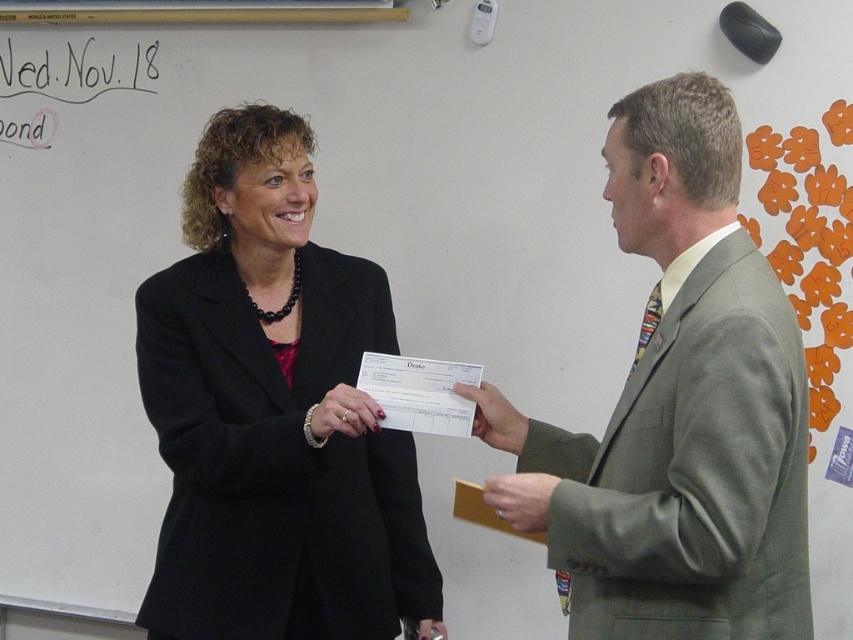
You are an observer in the classroom. You notice the black matte blazer at center and the matte gray suit at right. Which clothing item takes up more space in the image?

The black matte blazer at center takes up more space in the image because it is bigger than the matte gray suit at right.

Based on the photo, you are organizing a meeting and need to place a name tag on the table. The name tag is the size of the matte black check at center. Can you fit it on the white paper at center without overlapping the edges?

The white paper at center is bigger than the matte black check at center, so yes, the name tag can fit on the white paper at center without overlapping the edges.

You are standing in the classroom and want to hand a document to the person wearing the black matte blazer at center. Based on the coordinates provided, in which direction should you move to reach them?

The black matte blazer at center is located at coordinates point (271, 413). Since the person is at the center of the image, you should move towards the middle of the classroom to reach them.